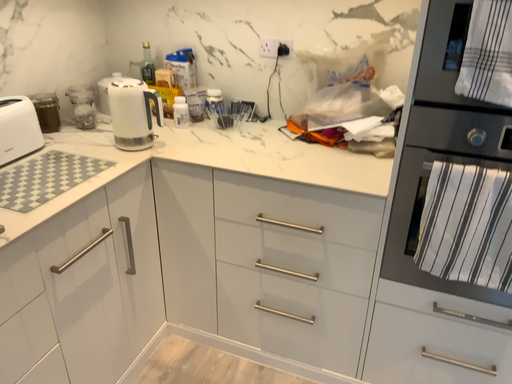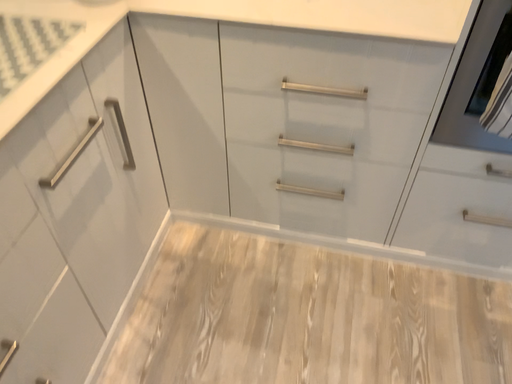
Question: How did the camera likely rotate when shooting the video?

Choices:
 (A) rotated downward
 (B) rotated upward

Answer: (A)